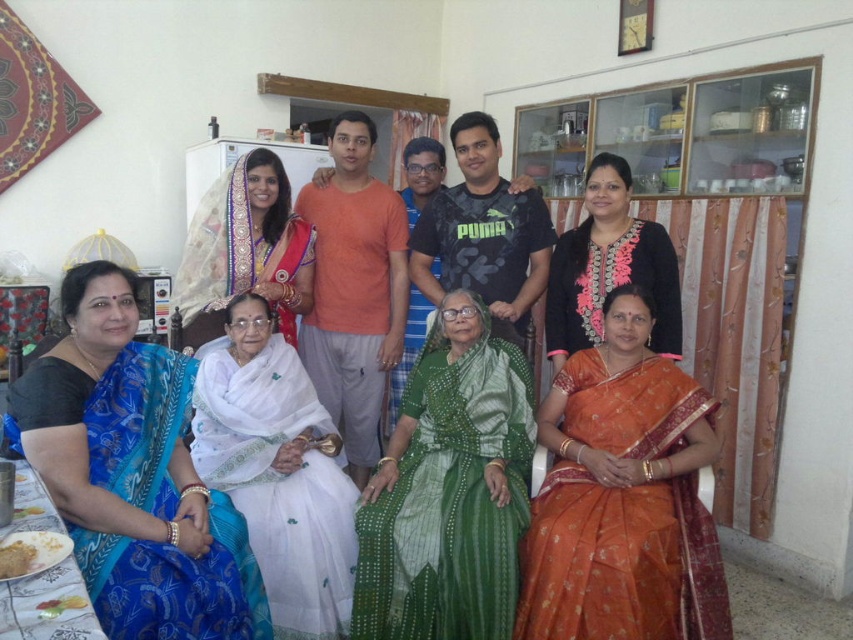
You are standing in the center of the room and want to move towards the silky blue sari at lower left. Which direction should you move?

Since the silky blue sari at lower left is located at point 0.853 on the x and 0.717 on the y axis, you should move towards the lower left direction to reach it.

You are a photographer standing in the center of the room. You need to capture a photo that includes both the orange silk saree at lower right and the white silk saree at upper left. Given that your camera has a maximum capture width of 1.5 meters, will you be able to fit both sarees into the frame without moving your position?

The distance between the orange silk saree at lower right and the white silk saree at upper left is 1.34 meters, which is within the camera maximum capture width of 1.5 meters. Therefore, you can fit both sarees into the frame without moving.